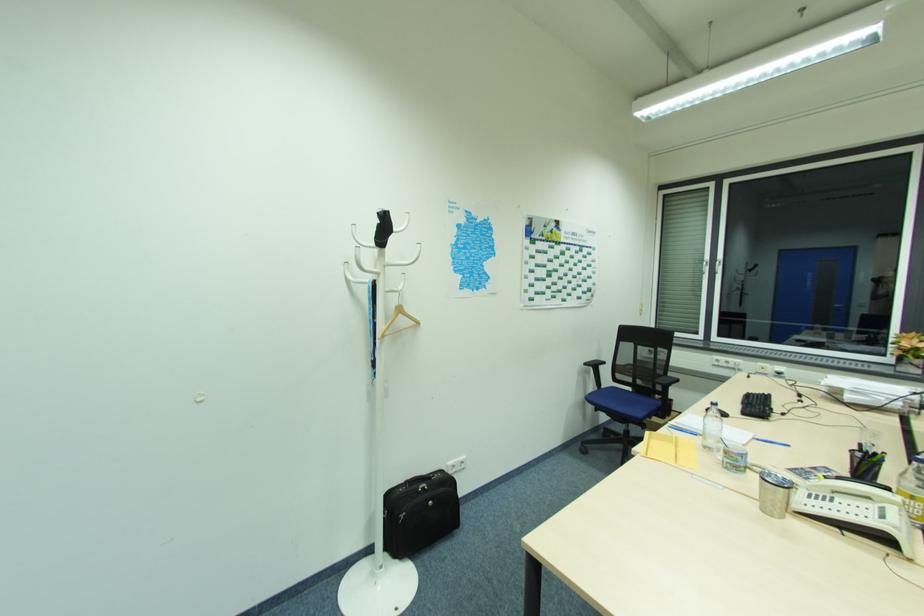
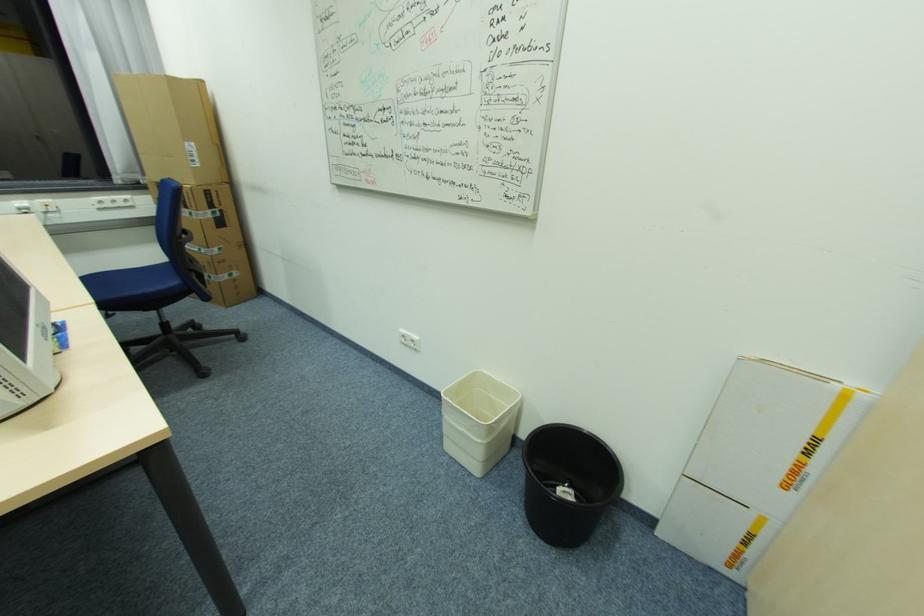
How did the camera likely rotate?

The camera rotated toward right-down.